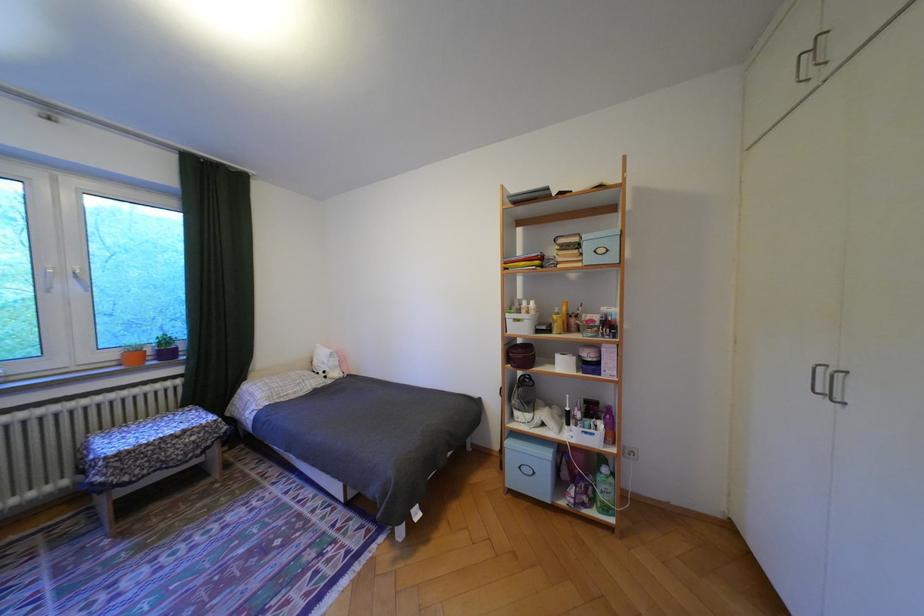
This screenshot has height=616, width=924. I want to click on white plastic basket, so click(x=520, y=323).